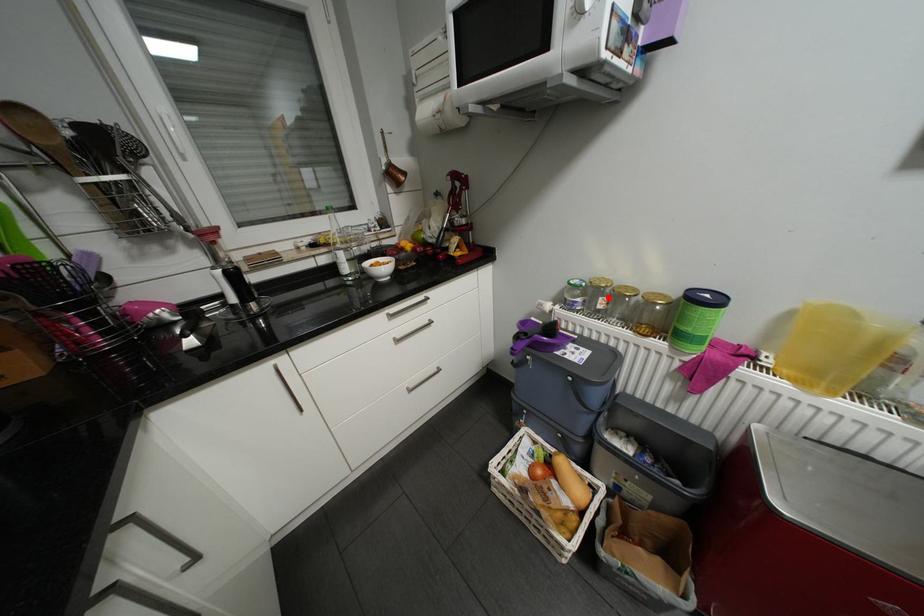
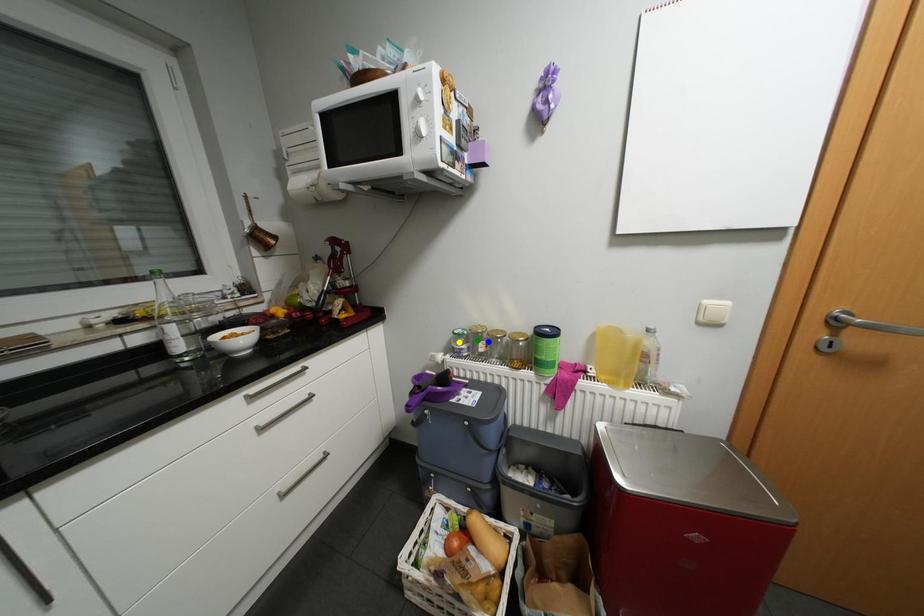
Question: I am providing you with two images of the same scene from different viewpoints. A red point is marked on the first image. You are given multiple points on the second image. Which spot in image 2 lines up with the point in image 1?

Choices:
 (A) green point
 (B) yellow point
 (C) blue point

Answer: (C)